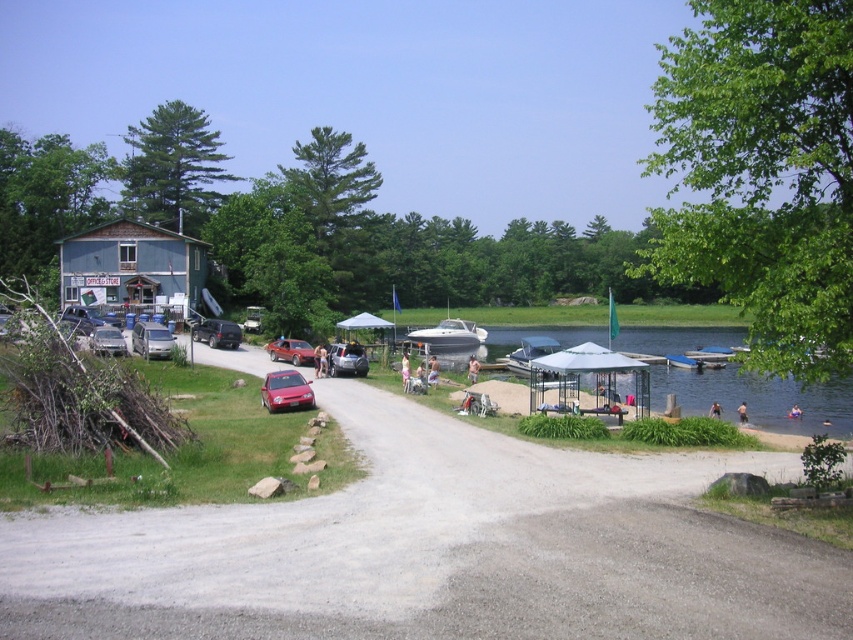
Is point (474, 332) closer to camera compared to point (143, 324)?

No, it is behind (143, 324).

Is point (412, 330) behind point (166, 342)?

Yes.

Locate an element on the screen. This screenshot has height=640, width=853. white glossy boat at center is located at coordinates (450, 337).

The height and width of the screenshot is (640, 853). In order to click on metallic silver car at center in this screenshot , I will do `click(346, 358)`.

Can you confirm if metallic silver car at center is taller than metallic silver car at center-left?

Incorrect, metallic silver car at center's height is not larger of metallic silver car at center-left's.

This screenshot has height=640, width=853. I want to click on metallic silver car at center, so click(346, 358).

Is white glossy boat at center bigger than shiny red car at center?

Yes.

Is point (479, 332) positioned after point (300, 355)?

Yes, point (479, 332) is farther from viewer.

Is point (428, 349) more distant than point (306, 364)?

Yes, it is behind point (306, 364).

Identify the location of white glossy boat at center. Image resolution: width=853 pixels, height=640 pixels. (450, 337).